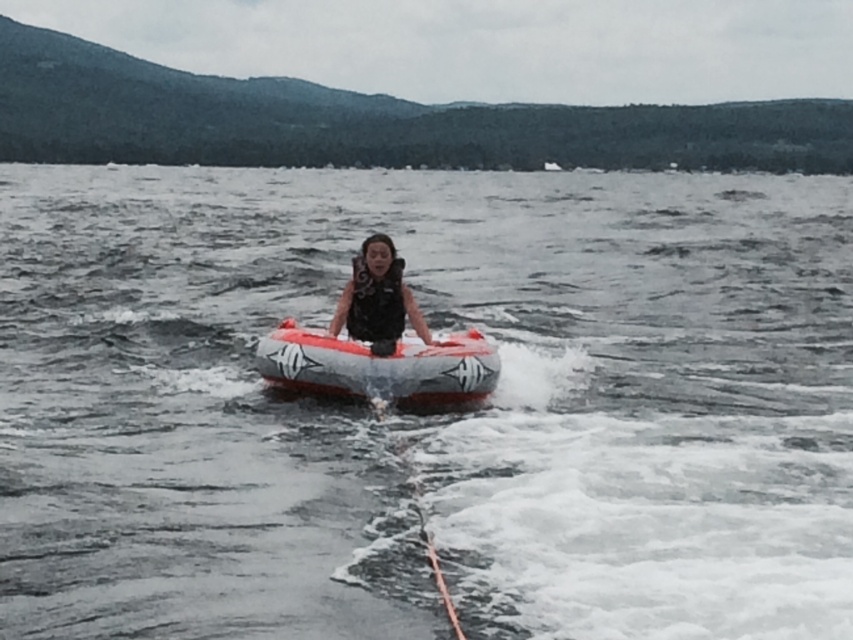
Question: Which object is closer to the camera taking this photo?

Choices:
 (A) black matte life vest at center
 (B) white foam water at center

Answer: (B)

Question: Does black matte life vest at center lie behind black matte life jacket at center?

Choices:
 (A) yes
 (B) no

Answer: (A)

Question: From the image, what is the correct spatial relationship of orange inflatable boat at center in relation to black matte life jacket at center?

Choices:
 (A) below
 (B) above

Answer: (A)

Question: Which object appears farthest from the camera in this image?

Choices:
 (A) orange inflatable boat at center
 (B) white foam water at center

Answer: (A)

Question: Is the position of orange inflatable boat at center more distant than that of black matte life vest at center?

Choices:
 (A) yes
 (B) no

Answer: (B)

Question: Estimate the real-world distances between objects in this image. Which object is farther from the white foam water at center?

Choices:
 (A) orange inflatable boat at center
 (B) black matte life jacket at center
 (C) black matte life vest at center

Answer: (C)